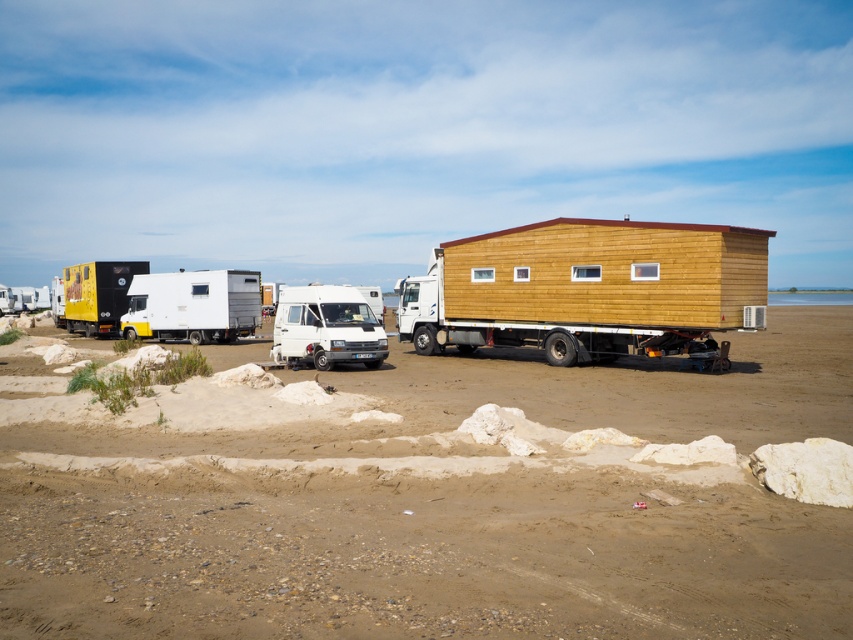
You are standing at the origin point of the coordinate system. Where is the brown sandy dirt field at lower center located?

The brown sandy dirt field at lower center is located at point (447, 512).

From the picture: You are a delivery person who needs to park your 6 meter long truck between the brown sandy dirt field at lower center and the white matte van at center. Is there enough space between them for your truck?

The distance between the brown sandy dirt field at lower center and the white matte van at center is 10.04 meters. Since your truck is 6 meters long, there is sufficient space to park it between them.

You are a delivery driver who needs to park your truck in the brown sandy dirt field at lower center. However, you notice the white matte van at center is already parked there. Based on the size comparison between the two, do you think there is enough space to park your truck alongside the van?

The brown sandy dirt field at lower center is larger in size than the white matte van at center, so there is likely enough space to park the truck alongside the van.